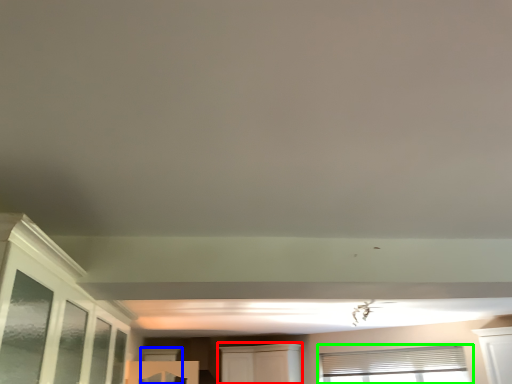
Question: Considering the real-world distances, which object is closest to cabinetry (highlighted by a red box)? window (highlighted by a blue box) or window (highlighted by a green box).

Choices:
 (A) window
 (B) window

Answer: (B)